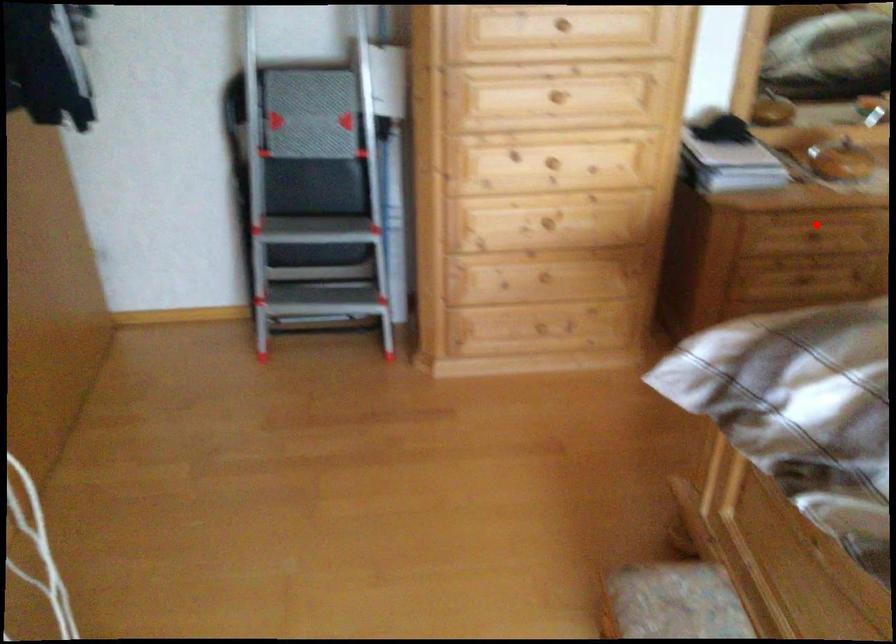
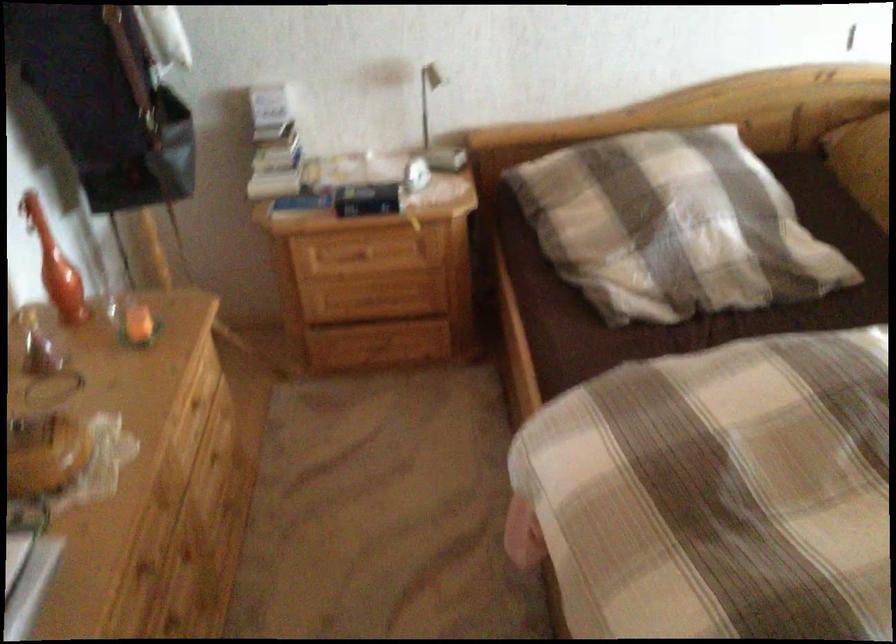
Question: A red point is marked in image1. In image2, is the corresponding 3D point closer to the camera or farther? Reply with the corresponding letter.

Choices:
 (A) The corresponding 3D point is closer.
 (B) The corresponding 3D point is farther.

Answer: (A)